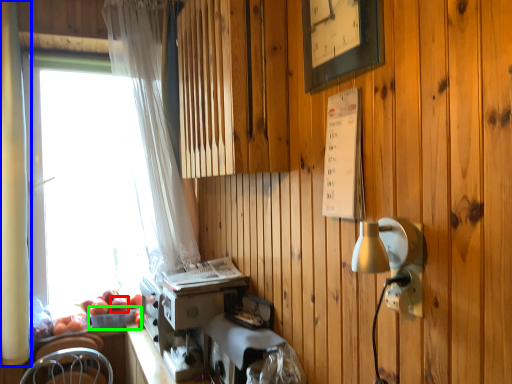
Question: Based on their relative distances, which object is nearer to apple (highlighted by a red box)? Choose from curtain (highlighted by a blue box) and basket (highlighted by a green box).

Choices:
 (A) curtain
 (B) basket

Answer: (B)